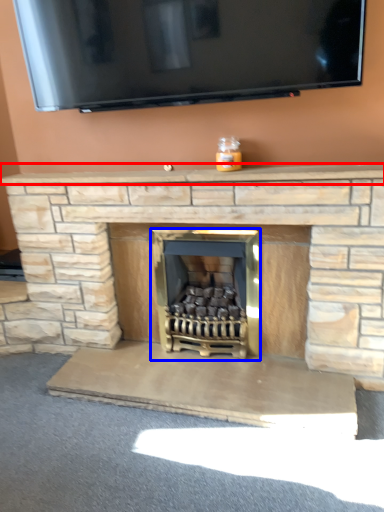
Question: Which object is closer to the camera taking this photo, mantle (highlighted by a red box) or wood burning stove (highlighted by a blue box)?

Choices:
 (A) mantle
 (B) wood burning stove

Answer: (A)